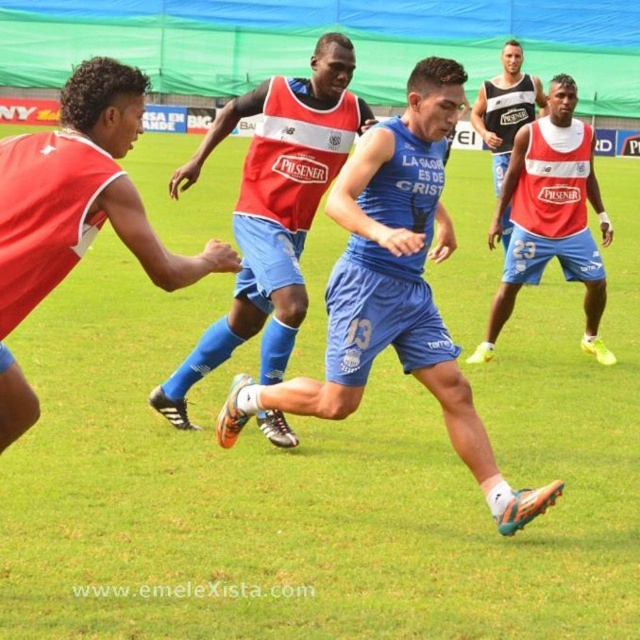
You are a soccer coach analyzing the training session. You see the blue fabric jersey at center represented by point (394, 291). What is the position of the blue fabric jersey at center?

The blue fabric jersey at center is represented by point (394, 291).

You are a referee observing the soccer field. You notice the blue fabric jersey at center and the matte black tank top at upper right. Which player is closer to the center of the field?

The blue fabric jersey at center is closer to the center of the field because it is positioned in front of the matte black tank top at upper right.